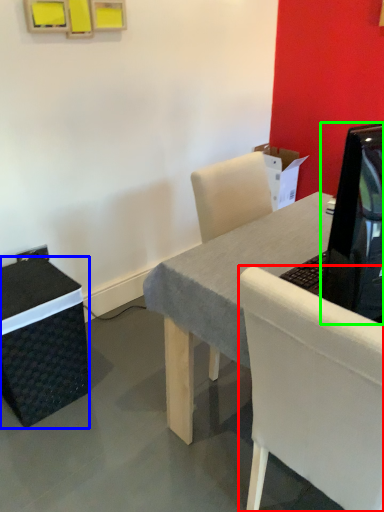
Question: Estimate the real-world distances between objects in this image. Which object is closer to chair (highlighted by a red box), box (highlighted by a blue box) or television (highlighted by a green box)?

Choices:
 (A) box
 (B) television

Answer: (B)